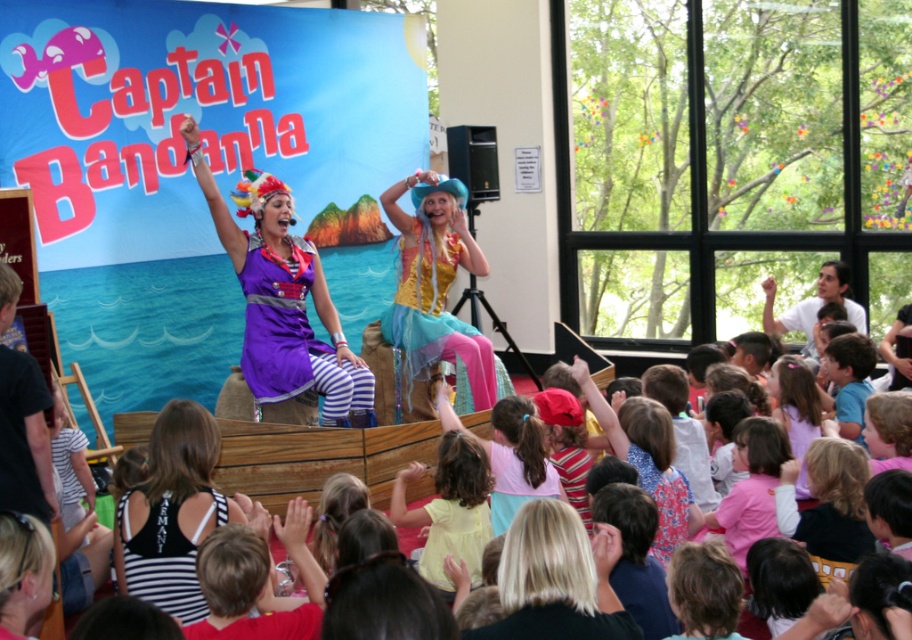
Which is in front, point (301, 273) or point (830, 275)?

Point (301, 273)

Can you confirm if purple satin dress at center is positioned below smooth white shirt at upper right?

Actually, purple satin dress at center is above smooth white shirt at upper right.

Where is `purple satin dress at center`? This screenshot has width=912, height=640. purple satin dress at center is located at coordinates tap(283, 301).

Is black striped tank top at lower left wider than shiny gold vest at center?

Incorrect, black striped tank top at lower left's width does not surpass shiny gold vest at center's.

Who is shorter, black striped tank top at lower left or shiny gold vest at center?

black striped tank top at lower left

The image size is (912, 640). What are the coordinates of `black striped tank top at lower left` in the screenshot? It's located at (171, 513).

Who is positioned more to the right, pink fabric dress at center or smooth white shirt at upper right?

From the viewer's perspective, smooth white shirt at upper right appears more on the right side.

Looking at this image, is pink fabric dress at center above smooth white shirt at upper right?

Incorrect, pink fabric dress at center is not positioned above smooth white shirt at upper right.

Describe the element at coordinates (517, 460) in the screenshot. The height and width of the screenshot is (640, 912). I see `pink fabric dress at center` at that location.

This screenshot has height=640, width=912. What are the coordinates of `pink fabric dress at center` in the screenshot? It's located at (517, 460).